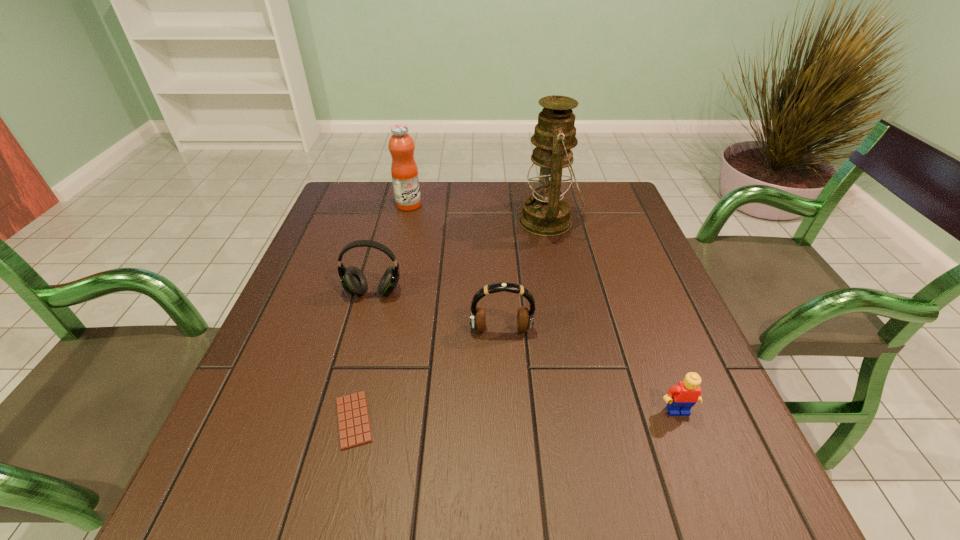
Find the location of `vacant space that is in between the fruit juice and the shortest object`. vacant space that is in between the fruit juice and the shortest object is located at coordinates (381, 313).

Locate an element on the screen. Image resolution: width=960 pixels, height=540 pixels. free space between the second shortest object and the shortest object is located at coordinates (516, 415).

At what (x,y) coordinates should I click in order to perform the action: click on vacant area that lies between the candy bar and the right headset. Please return your answer as a coordinate pair (x, y). This screenshot has width=960, height=540. Looking at the image, I should click on (427, 375).

I want to click on vacant area that lies between the fifth shortest object and the third farthest object, so click(x=391, y=248).

Identify the location of free space between the third nearest object and the left headset. The image size is (960, 540). (438, 311).

Locate an element on the screen. The height and width of the screenshot is (540, 960). object that can be found as the fifth closest to the rightmost object is located at coordinates (404, 170).

Image resolution: width=960 pixels, height=540 pixels. What are the coordinates of `object that is the second closest one to the tallest object` in the screenshot? It's located at tap(404, 170).

What are the coordinates of `free spot that satisfies the following two spatial constraints: 1. on the front label of the fruit juice; 2. on the back side of the oil lamp` in the screenshot? It's located at (405, 221).

This screenshot has width=960, height=540. I want to click on free point that satisfies the following two spatial constraints: 1. on the back side of the oil lamp; 2. on the front label of the second tallest object, so click(545, 205).